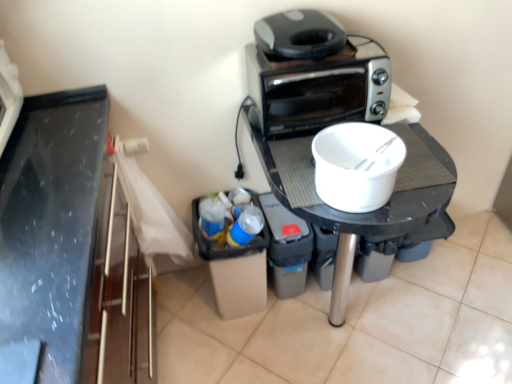
Locate an element on the screen. This screenshot has width=512, height=384. unoccupied region to the right of black plastic table at center is located at coordinates (455, 305).